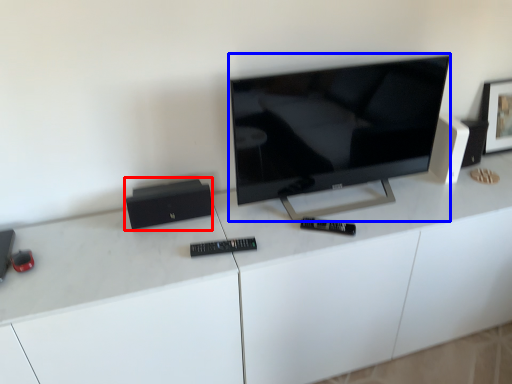
Question: Which object appears closest to the camera in this image, speaker (highlighted by a red box) or television (highlighted by a blue box)?

Choices:
 (A) speaker
 (B) television

Answer: (B)